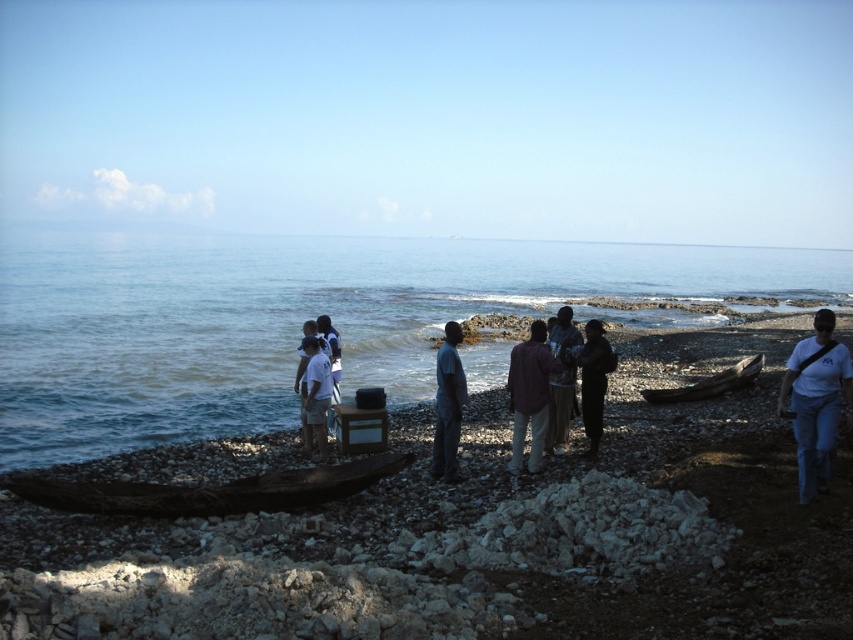
Based on the photo, which of these two, smooth pebbles at center or dark blue fabric at center, stands taller?

With more height is dark blue fabric at center.

Does smooth pebbles at center have a lesser width compared to dark blue fabric at center?

Incorrect, smooth pebbles at center's width is not less than dark blue fabric at center's.

Which is behind, point (851, 500) or point (456, 406)?

The point (456, 406) is more distant.

The image size is (853, 640). Identify the location of smooth pebbles at center. (486, 536).

Does blue water at center appear on the right side of plaid fabric shirt at center?

Yes, blue water at center is to the right of plaid fabric shirt at center.

Who is positioned more to the right, blue water at center or plaid fabric shirt at center?

From the viewer's perspective, blue water at center appears more on the right side.

At what (x,y) coordinates should I click in order to perform the action: click on blue water at center. Please return your answer as a coordinate pair (x, y). Looking at the image, I should click on (297, 320).

Where is `blue water at center`? The width and height of the screenshot is (853, 640). blue water at center is located at coordinates (297, 320).

Does dark blue fabric at center have a lesser width compared to dark brown leather jacket at center?

No, dark blue fabric at center is not thinner than dark brown leather jacket at center.

Between point (463, 400) and point (550, 404), which one is positioned in front?

Positioned in front is point (463, 400).

You are a GUI agent. You are given a task and a screenshot of the screen. Output one action in this format:
    pyautogui.click(x=<x>, y=<y>)
    Task: Click on the dark blue fabric at center
    Image resolution: width=853 pixels, height=640 pixels.
    Given the screenshot: What is the action you would take?
    pyautogui.click(x=448, y=404)

This screenshot has height=640, width=853. In order to click on dark blue fabric at center in this screenshot , I will do `click(448, 404)`.